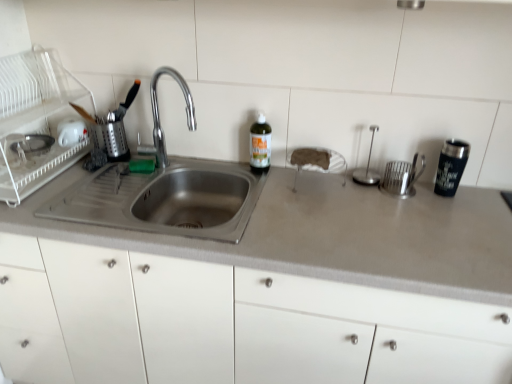
Where is `vacant area that is in front of polished stainless steel spoon holder at right, positioned as the second appliance in right-to-left order`? The image size is (512, 384). vacant area that is in front of polished stainless steel spoon holder at right, positioned as the second appliance in right-to-left order is located at coordinates (382, 205).